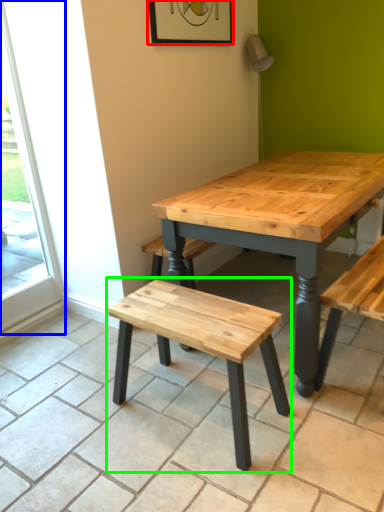
Question: Which object is the closest to the picture frame (highlighted by a red box)? Choose among these: screen door (highlighted by a blue box) or stool (highlighted by a green box).

Choices:
 (A) screen door
 (B) stool

Answer: (A)